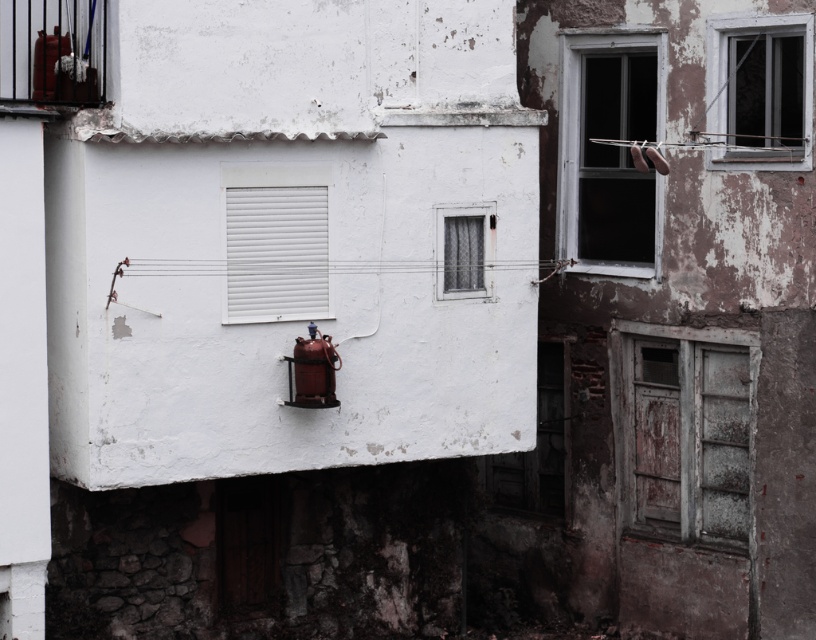
What do you see at coordinates (683, 432) in the screenshot? The height and width of the screenshot is (640, 816). I see `weathered wood window at center right` at bounding box center [683, 432].

Between weathered wood window at center right and wooden door at lower center, which one has more height?

weathered wood window at center right is taller.

Is point (688, 426) farther from camera compared to point (548, 392)?

No, it is not.

This screenshot has height=640, width=816. I want to click on weathered wood window at center right, so click(683, 432).

Which of these two, weathered wood window at center right or metallic wire at center, stands shorter?

Standing shorter between the two is metallic wire at center.

Is point (698, 474) farther from viewer compared to point (375, 266)?

Yes, point (698, 474) is farther from viewer.

Is point (624, 371) behind point (370, 262)?

That is True.

The width and height of the screenshot is (816, 640). I want to click on weathered wood window at center right, so click(x=683, y=432).

Between transparent glass window at upper right and clear glass window at upper right, which one has more height?

transparent glass window at upper right is taller.

Between point (641, 51) and point (750, 93), which one is positioned behind?

The point (641, 51) is behind.

Where is `transparent glass window at upper right`? transparent glass window at upper right is located at coordinates (610, 150).